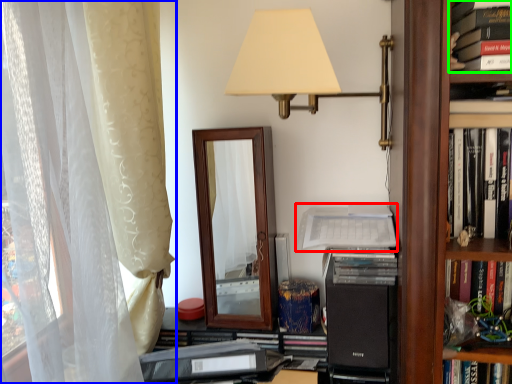
Question: Based on their relative distances, which object is farther from paperback book (highlighted by a red box)? Choose from curtain (highlighted by a blue box) and book (highlighted by a green box).

Choices:
 (A) curtain
 (B) book

Answer: (A)